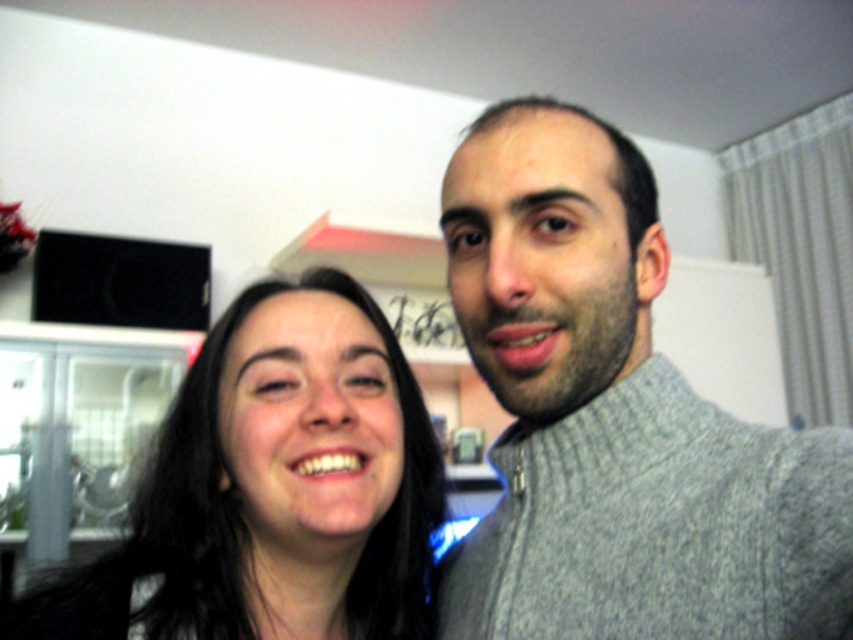
Which of these two, gray knitted sweater at center or smooth black hair at center, stands shorter?

With less height is smooth black hair at center.

Is gray knitted sweater at center to the left of smooth black hair at center from the viewer's perspective?

Incorrect, gray knitted sweater at center is not on the left side of smooth black hair at center.

Locate an element on the screen. gray knitted sweater at center is located at coordinates (614, 419).

I want to click on gray knitted sweater at center, so click(x=614, y=419).